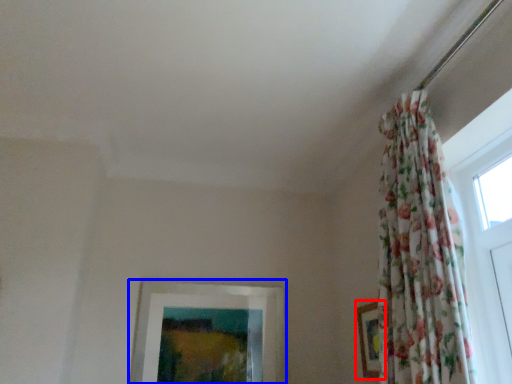
Question: Which object appears farthest to the camera in this image, picture frame (highlighted by a red box) or picture frame (highlighted by a blue box)?

Choices:
 (A) picture frame
 (B) picture frame

Answer: (B)